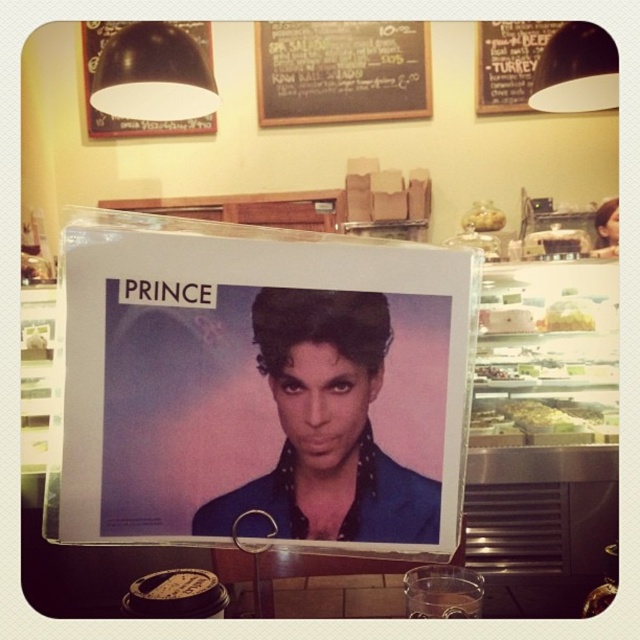
Question: Among these points, which one is nearest to the camera?

Choices:
 (A) (504, 33)
 (B) (326, 525)
 (C) (365, 48)
 (D) (125, 131)

Answer: (B)

Question: Observing the image, what is the correct spatial positioning of black matte bulletin board at upper left in reference to translucent plastic food at center?

Choices:
 (A) above
 (B) below

Answer: (A)

Question: Among these objects, which one is farthest from the camera?

Choices:
 (A) black matte bulletin board at upper left
 (B) translucent plastic food at center

Answer: (A)

Question: Is black chalkboard menu at upper center wider than green leafy salad at center?

Choices:
 (A) yes
 (B) no

Answer: (A)

Question: Among these points, which one is nearest to the camera?

Choices:
 (A) (314, 388)
 (B) (262, 52)

Answer: (A)

Question: Can you confirm if black matte bulletin board at upper left is bigger than black chalkboard at upper center?

Choices:
 (A) no
 (B) yes

Answer: (B)